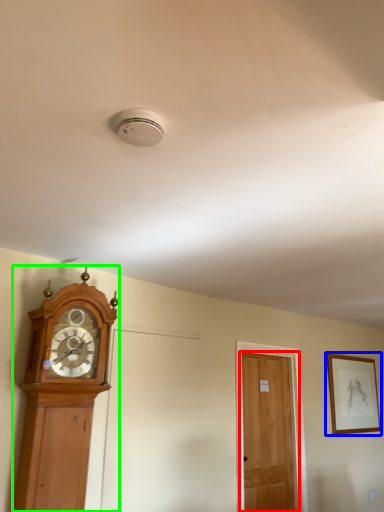
Question: Which object is positioned closest to door (highlighted by a red box)? Select from picture frame (highlighted by a blue box) and wall clock (highlighted by a green box).

Choices:
 (A) picture frame
 (B) wall clock

Answer: (A)